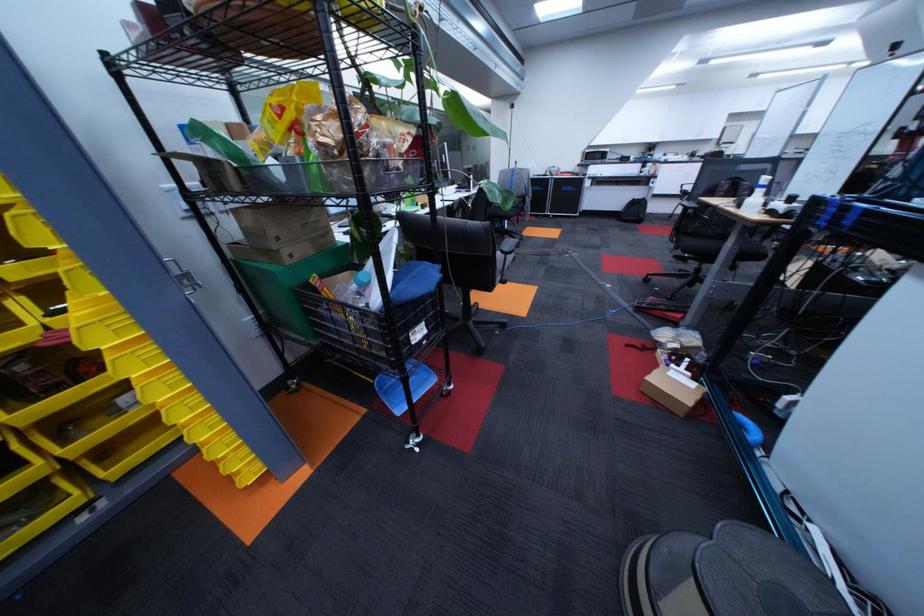
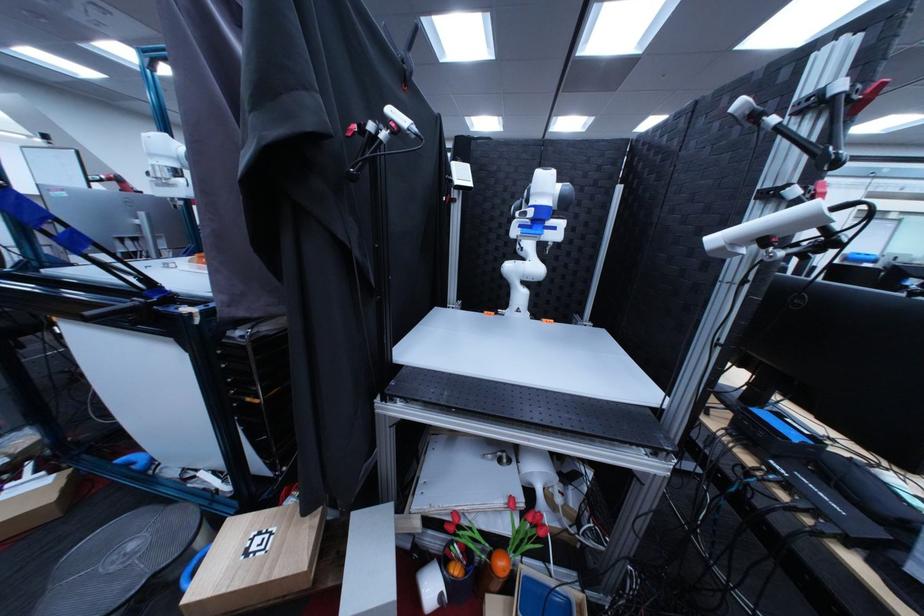
The first image is from the beginning of the video and the second image is from the end. How did the camera likely rotate when shooting the video?

The rotation direction of the camera is right-down.